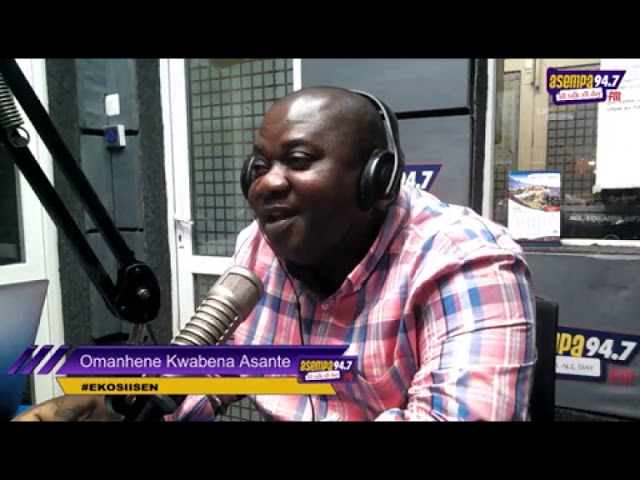
In order to click on window in this screenshot , I will do `click(525, 119)`.